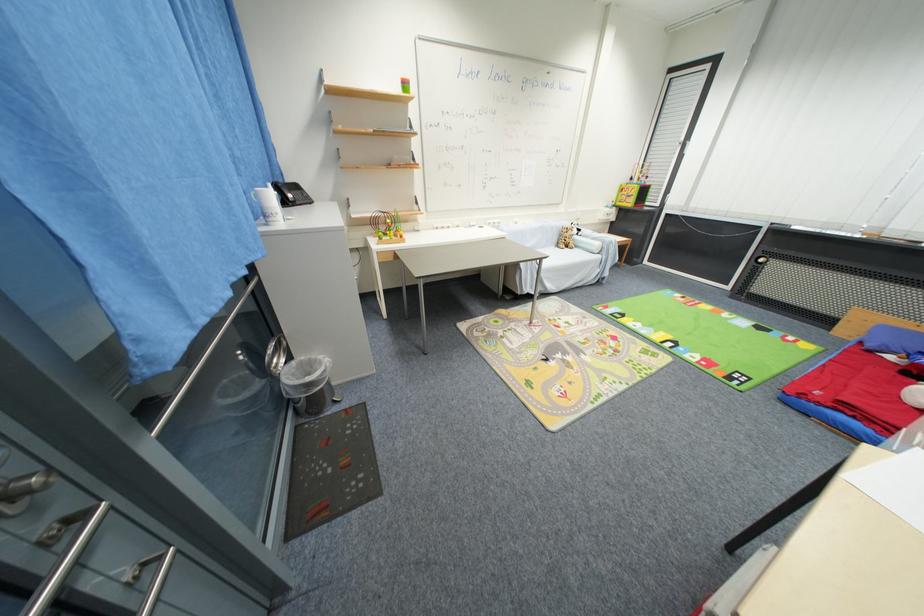
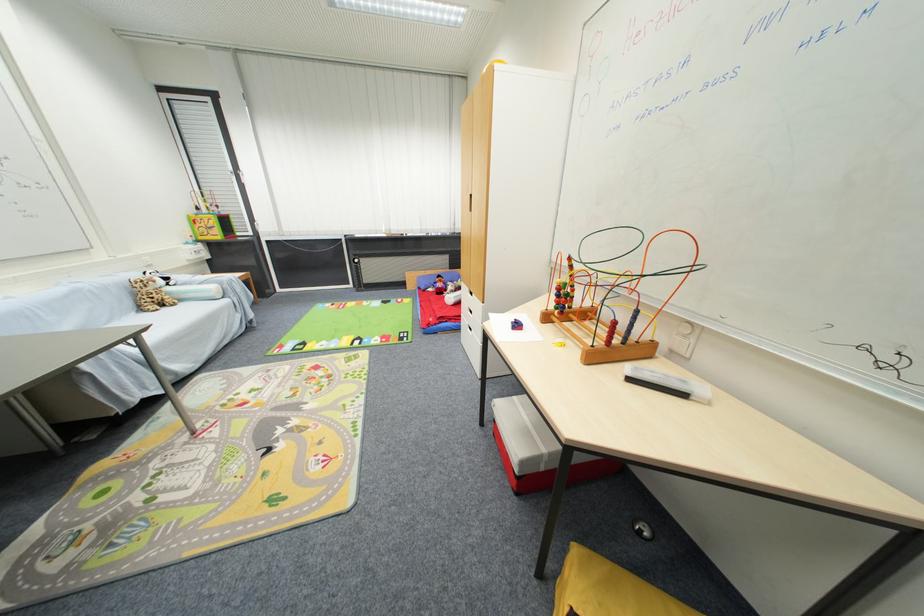
In the second image, find the point that corresponds to the point at 613,212 in the first image.

(198, 249)